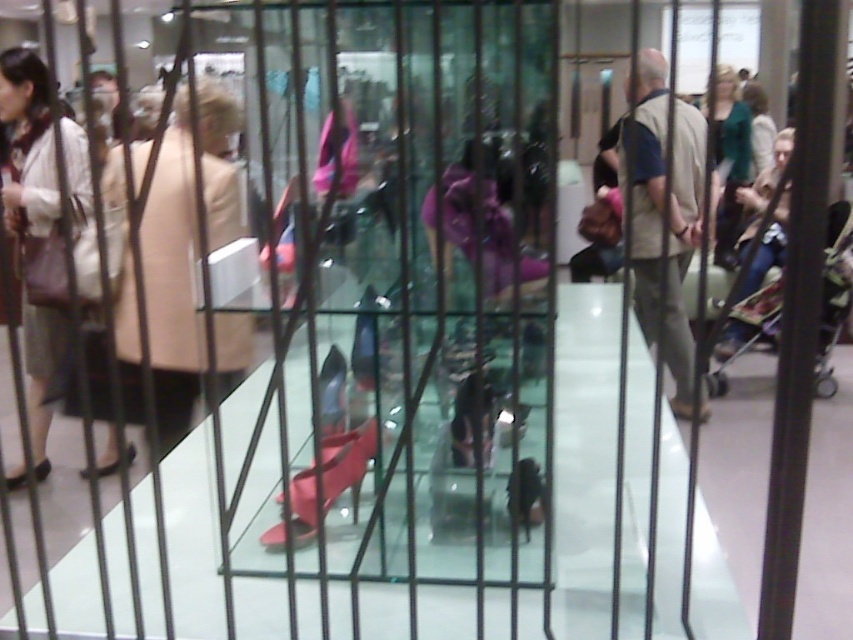
You are a store employee who needs to retrieve the matte beige coat at left from the display. The store requires that you maintain a minimum distance of 2 meters between yourself and customers. Can you safely retrieve the coat without violating the safety protocol?

The matte beige coat at left is 2.86 meters away from the customers, so yes, you can safely retrieve it while maintaining the required 2 meter distance.

You are a customer in the store and want to see both the matte beige coat at left and the matte green sweater at upper right. Which item is closer to you?

The matte beige coat at left is closer to you because it is positioned under the matte green sweater at upper right, meaning it is lower in the scene and thus nearer.